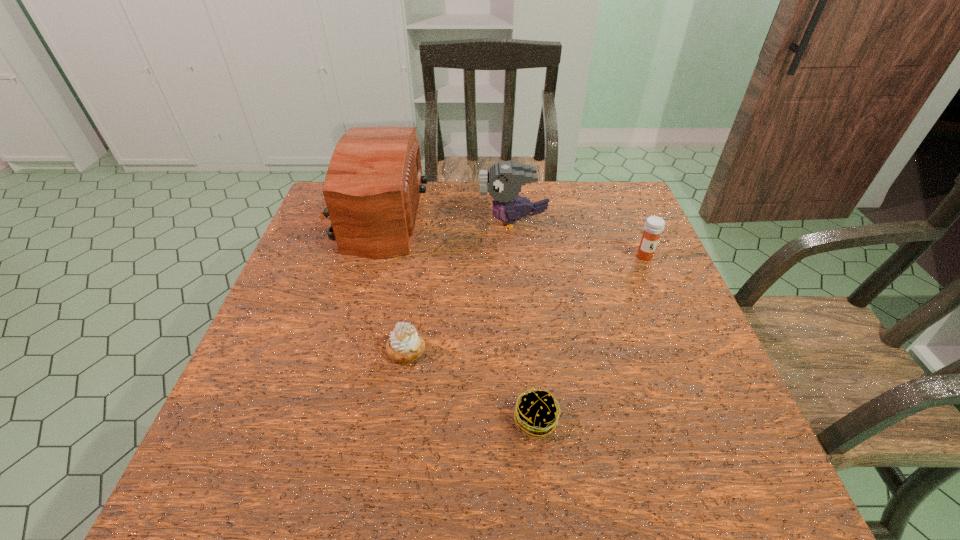
Where is `vacant point located between the medicine and the bird`? vacant point located between the medicine and the bird is located at coordinates (579, 239).

The image size is (960, 540). What are the coordinates of `vacant space in between the pastry and the tallest object` in the screenshot? It's located at (390, 284).

You are a GUI agent. You are given a task and a screenshot of the screen. Output one action in this format:
    pyautogui.click(x=<x>, y=<y>)
    Task: Click on the free space between the bird and the medicine
    This screenshot has width=960, height=540.
    Given the screenshot: What is the action you would take?
    pyautogui.click(x=579, y=239)

Identify which object is the third closest to the patty. Please provide its 2D coordinates. Your answer should be formatted as a tuple, i.e. [(x, y)], where the tuple contains the x and y coordinates of a point satisfying the conditions above.

[(654, 225)]

Where is `the closest object relative to the nearest object`? the closest object relative to the nearest object is located at coordinates (405, 345).

Find the location of a particular element. The width and height of the screenshot is (960, 540). vacant area in the image that satisfies the following two spatial constraints: 1. at the beak of the second tallest object; 2. on the left side of the patty is located at coordinates (532, 420).

Locate an element on the screen. free space that satisfies the following two spatial constraints: 1. at the beak of the fourth shortest object; 2. on the front side of the second nearest object is located at coordinates (525, 350).

This screenshot has width=960, height=540. Find the location of `free space that satisfies the following two spatial constraints: 1. at the beak of the patty; 2. on the right side of the fourth shortest object`. free space that satisfies the following two spatial constraints: 1. at the beak of the patty; 2. on the right side of the fourth shortest object is located at coordinates (532, 420).

I want to click on vacant position in the image that satisfies the following two spatial constraints: 1. on the front-facing side of the radio receiver; 2. on the left side of the pastry, so click(x=332, y=350).

Image resolution: width=960 pixels, height=540 pixels. In order to click on vacant area that satisfies the following two spatial constraints: 1. on the front-facing side of the fourth farthest object; 2. on the right side of the radio receiver in this screenshot , I will do `click(332, 350)`.